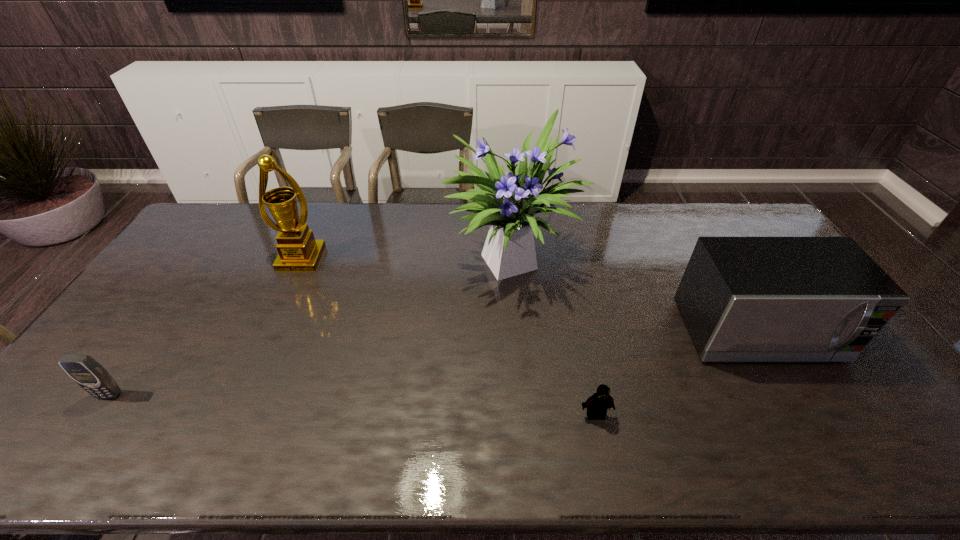
Find the location of a particular element. free space between the nearest object and the second tallest object is located at coordinates (448, 337).

The height and width of the screenshot is (540, 960). What are the coordinates of `object that stands as the fourth closest to the third shortest object` in the screenshot? It's located at (83, 369).

Identify which object is the third nearest to the tallest object. Please provide its 2D coordinates. Your answer should be formatted as a tuple, i.e. [(x, y)], where the tuple contains the x and y coordinates of a point satisfying the conditions above.

[(298, 251)]